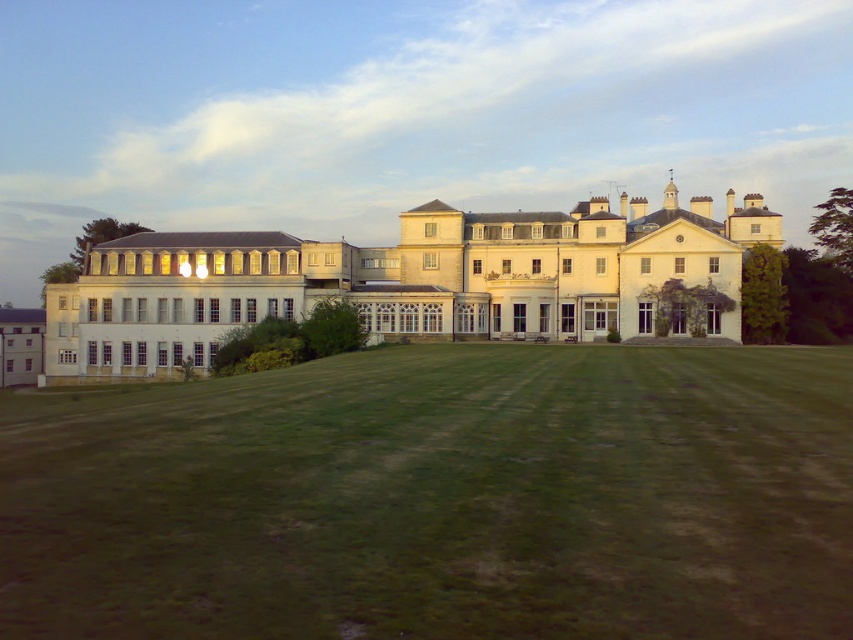
Question: Is green grass at center closer to the viewer compared to white smooth mansion at center?

Choices:
 (A) no
 (B) yes

Answer: (B)

Question: Can you confirm if green grass at center is positioned to the left of white smooth mansion at center?

Choices:
 (A) no
 (B) yes

Answer: (B)

Question: Which object is closer to the camera taking this photo?

Choices:
 (A) green grass at center
 (B) white smooth mansion at center

Answer: (A)

Question: In this image, where is green grass at center located relative to white smooth mansion at center?

Choices:
 (A) right
 (B) left

Answer: (B)

Question: Among these objects, which one is nearest to the camera?

Choices:
 (A) green grass at center
 (B) white smooth mansion at center

Answer: (A)